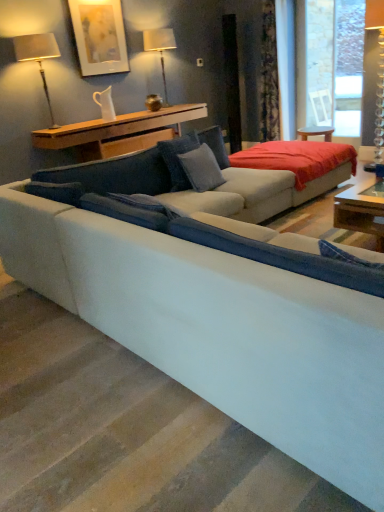
Question: Does suede-like blue pillow at center, the first pillow from the left, lie in front of matte silver table lamp at upper left, which ranks as the 1th table lamp in front-to-back order?

Choices:
 (A) no
 (B) yes

Answer: (B)

Question: Can you confirm if suede-like blue pillow at center, which is the second pillow in right-to-left order, is positioned to the left of matte silver table lamp at upper left, the 2th table lamp positioned from the right?

Choices:
 (A) yes
 (B) no

Answer: (B)

Question: Does suede-like blue pillow at center, the first pillow from the left, have a greater height compared to matte silver table lamp at upper left, which ranks as the 1th table lamp in left-to-right order?

Choices:
 (A) no
 (B) yes

Answer: (A)

Question: Would you say suede-like blue pillow at center, the first pillow from the left, is outside matte silver table lamp at upper left, the second table lamp when ordered from back to front?

Choices:
 (A) no
 (B) yes

Answer: (B)

Question: Does suede-like blue pillow at center, the first pillow from the left, have a lesser width compared to matte silver table lamp at upper left, which ranks as the 1th table lamp in front-to-back order?

Choices:
 (A) yes
 (B) no

Answer: (B)

Question: Considering the positions of suede-like blue pillow at center, which is the second pillow in right-to-left order, and matte white picture frame at upper left in the image, is suede-like blue pillow at center, which is the second pillow in right-to-left order, bigger or smaller than matte white picture frame at upper left?

Choices:
 (A) small
 (B) big

Answer: (B)

Question: Considering the positions of suede-like blue pillow at center, the first pillow from the left, and matte white picture frame at upper left in the image, is suede-like blue pillow at center, the first pillow from the left, wider or thinner than matte white picture frame at upper left?

Choices:
 (A) thin
 (B) wide

Answer: (B)

Question: From their relative heights in the image, would you say suede-like blue pillow at center, which is the second pillow in right-to-left order, is taller or shorter than matte white picture frame at upper left?

Choices:
 (A) tall
 (B) short

Answer: (B)

Question: Visually, is suede-like blue pillow at center, which is the second pillow in right-to-left order, positioned to the left or to the right of matte white picture frame at upper left?

Choices:
 (A) left
 (B) right

Answer: (B)

Question: Choose the correct answer: Is suede-like blue pillow at center, which is the second pillow in right-to-left order, inside matte white lampshade at upper center, which is counted as the first table lamp, starting from the back, or outside it?

Choices:
 (A) inside
 (B) outside

Answer: (B)

Question: From a real-world perspective, is suede-like blue pillow at center, the first pillow from the left, physically located above or below matte white lampshade at upper center, which is counted as the first table lamp, starting from the back?

Choices:
 (A) above
 (B) below

Answer: (B)

Question: In terms of height, does suede-like blue pillow at center, which is the second pillow in right-to-left order, look taller or shorter compared to matte white lampshade at upper center, placed as the 2th table lamp when sorted from front to back?

Choices:
 (A) tall
 (B) short

Answer: (B)

Question: Is suede-like blue pillow at center, the first pillow from the left, in front of or behind matte white lampshade at upper center, which is counted as the first table lamp, starting from the back, in the image?

Choices:
 (A) front
 (B) behind

Answer: (A)

Question: From a real-world perspective, is wooden shelf at upper center positioned above or below suede-like blue pillow at center, the first pillow from the left?

Choices:
 (A) below
 (B) above

Answer: (B)

Question: Which is correct: wooden shelf at upper center is inside suede-like blue pillow at center, the first pillow from the left, or outside of it?

Choices:
 (A) outside
 (B) inside

Answer: (A)